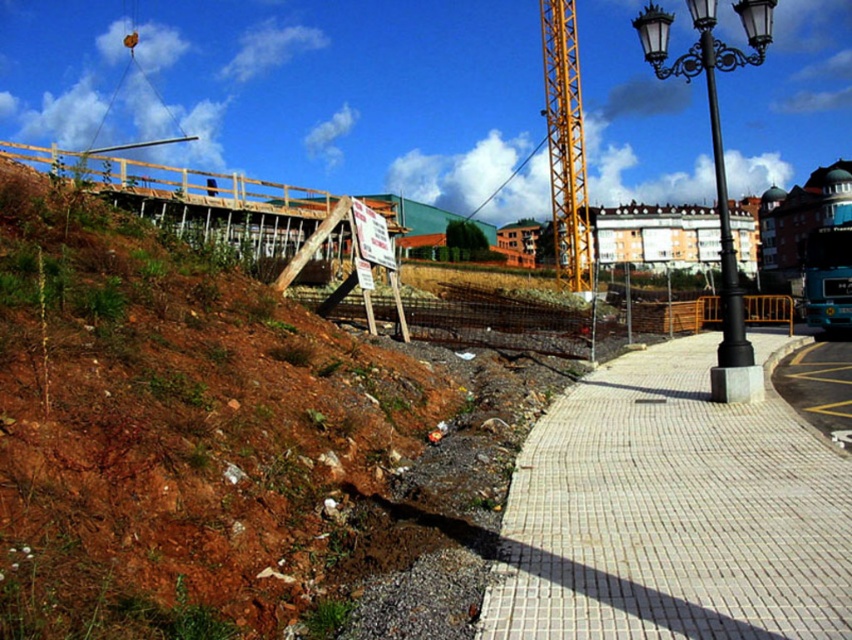
Question: Among these objects, which one is nearest to the camera?

Choices:
 (A) yellow metallic crane at center
 (B) white brick pavement at lower right
 (C) black metal streetlight at right
 (D) brown dirt at left

Answer: (D)

Question: Is brown dirt at left bigger than black metal streetlight at right?

Choices:
 (A) yes
 (B) no

Answer: (B)

Question: Is white brick pavement at lower right bigger than yellow metallic crane at center?

Choices:
 (A) no
 (B) yes

Answer: (A)

Question: Which object is closer to the camera taking this photo?

Choices:
 (A) black metal streetlight at right
 (B) white brick pavement at lower right

Answer: (B)

Question: Can you confirm if white brick pavement at lower right is thinner than black metal streetlight at right?

Choices:
 (A) yes
 (B) no

Answer: (A)

Question: Which point is farther to the camera?

Choices:
 (A) white brick pavement at lower right
 (B) brown dirt at left

Answer: (A)